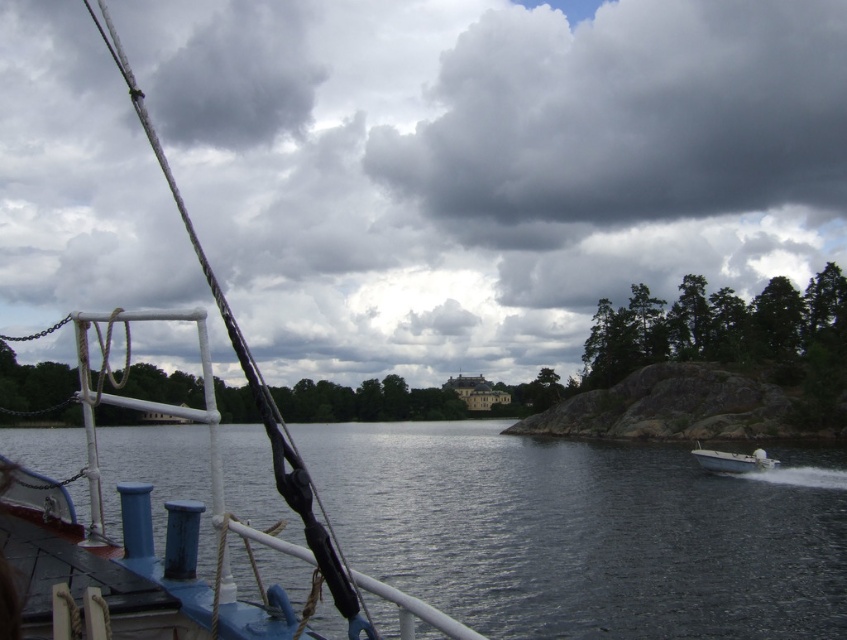
Question: Can you confirm if dark gray fluffy cloud at upper center is positioned to the right of white plastic boat at lower right?

Choices:
 (A) yes
 (B) no

Answer: (A)

Question: Does dark blue water at center have a smaller size compared to dark gray fluffy cloud at upper center?

Choices:
 (A) yes
 (B) no

Answer: (A)

Question: Among these objects, which one is farthest from the camera?

Choices:
 (A) dark blue water at center
 (B) dark gray cloud at upper center

Answer: (B)

Question: Which is nearer to the dark gray fluffy cloud at upper center?

Choices:
 (A) blue matte boat at left
 (B) dark blue water at center

Answer: (A)

Question: From the image, what is the correct spatial relationship of dark gray fluffy cloud at upper center in relation to blue matte boat at left?

Choices:
 (A) right
 (B) left

Answer: (A)

Question: Which object appears closest to the camera in this image?

Choices:
 (A) dark gray fluffy cloud at upper center
 (B) blue matte boat at left
 (C) dark gray cloud at upper center

Answer: (B)